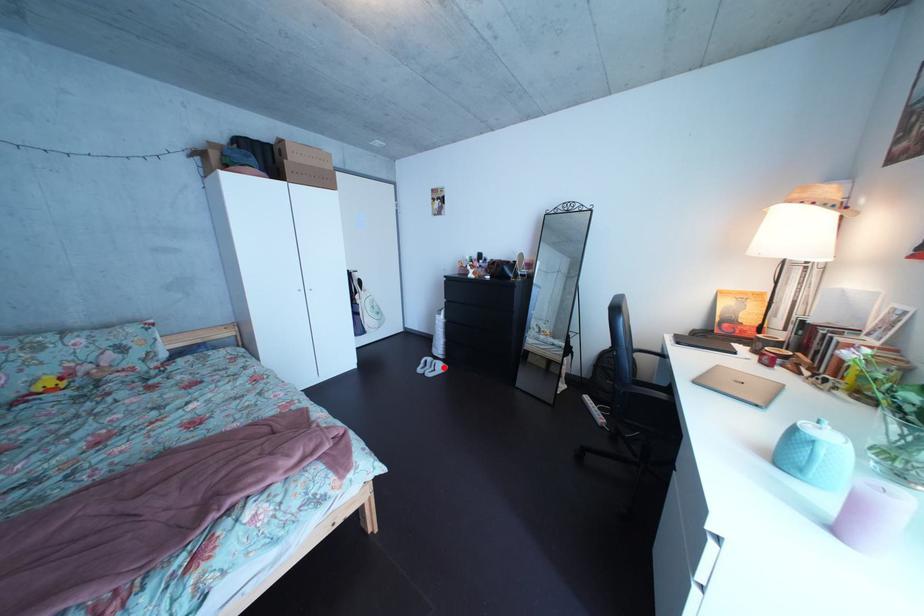
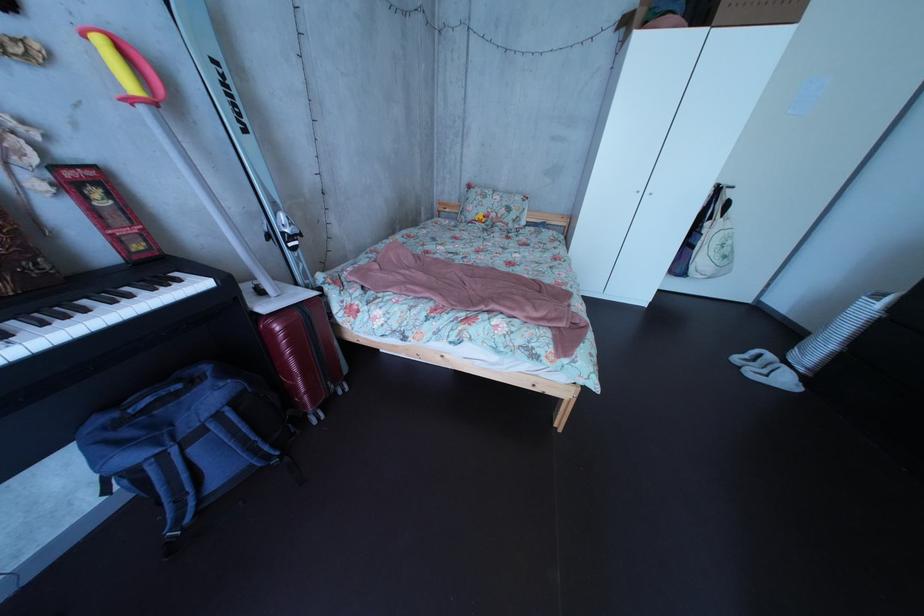
Question: I am providing you with two images of the same scene from different viewpoints. Given a red point in image1, look at the same physical point in image2. Is it:

Choices:
 (A) Closer to the viewpoint
 (B) Farther from the viewpoint

Answer: (A)